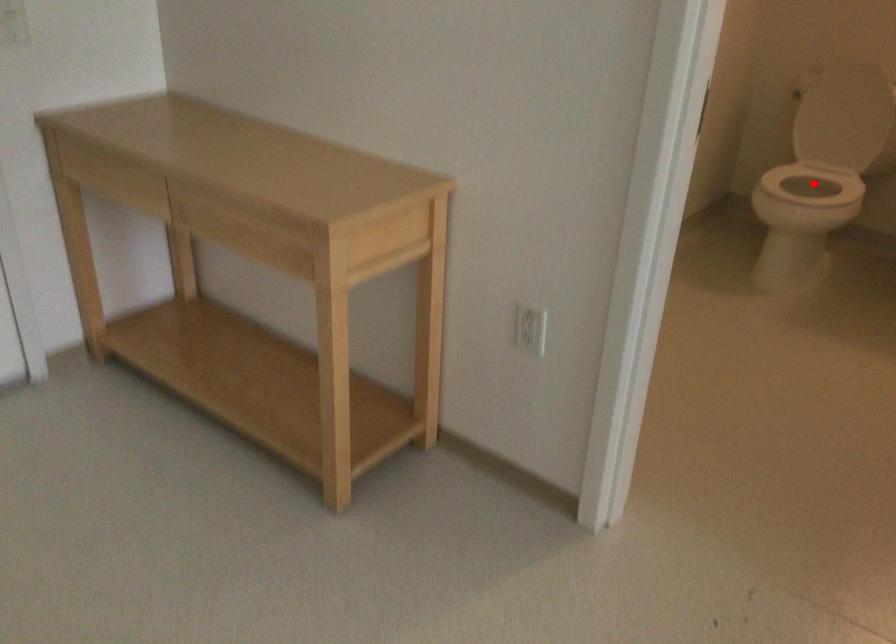
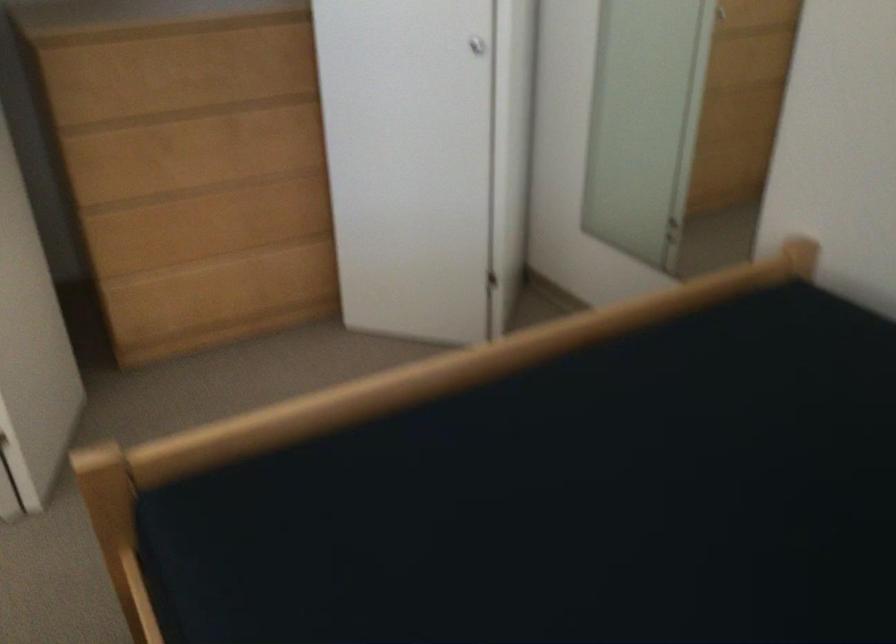
Question: I am providing you with two images of the same scene from different viewpoints. A red point is marked on the first image. Can you still see the location of the red point in image 2?

Choices:
 (A) Yes
 (B) No

Answer: (B)